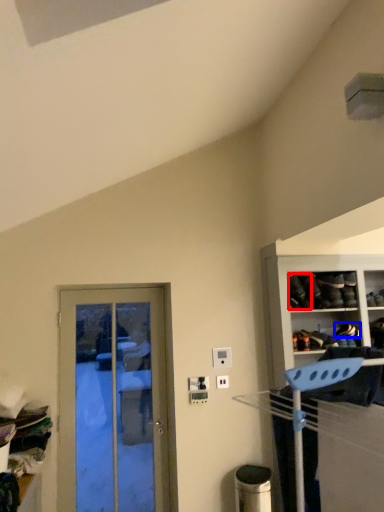
Question: Among these objects, which one is farthest to the camera, shoe (highlighted by a red box) or shoe (highlighted by a blue box)?

Choices:
 (A) shoe
 (B) shoe

Answer: (B)